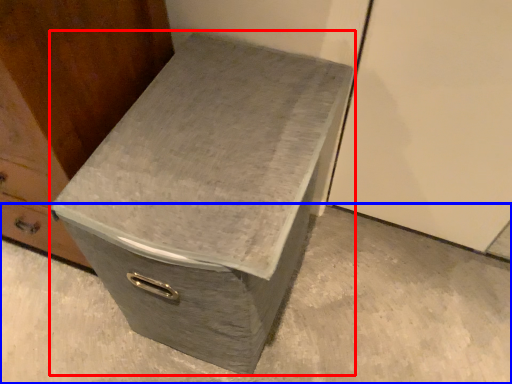
Question: Which object appears closest to the camera in this image, shoe box (highlighted by a red box) or concrete (highlighted by a blue box)?

Choices:
 (A) shoe box
 (B) concrete

Answer: (A)